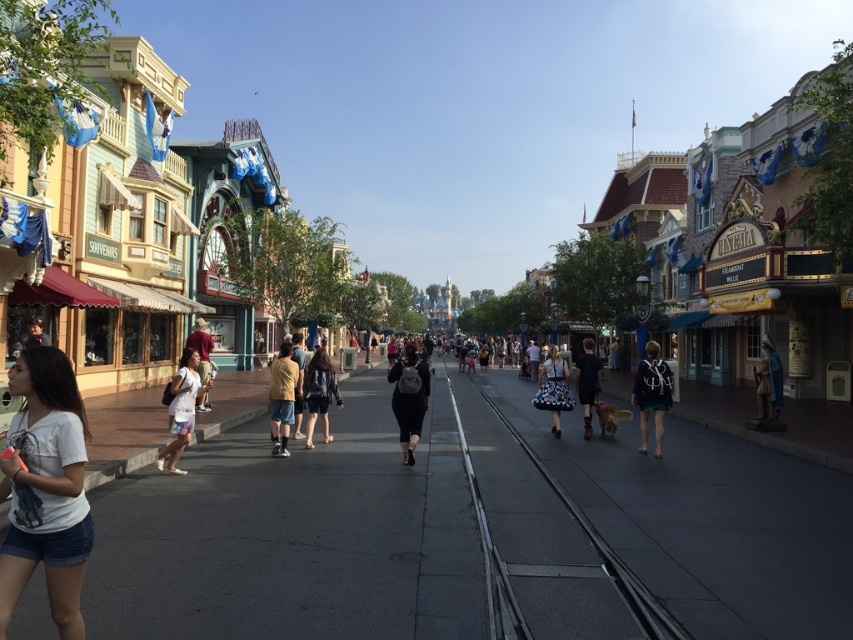
Can you confirm if black matte backpack at center is positioned to the right of dotted floral skirt at center?

Incorrect, black matte backpack at center is not on the right side of dotted floral skirt at center.

Does black matte backpack at center have a greater width compared to dotted floral skirt at center?

No.

Which is behind, point (402, 460) or point (544, 394)?

Positioned behind is point (544, 394).

The image size is (853, 640). I want to click on black matte backpack at center, so click(409, 397).

Between white cotton t-shirt at lower left and denim jacket at center, which one appears on the right side from the viewer's perspective?

denim jacket at center

Does white cotton t-shirt at lower left have a larger size compared to denim jacket at center?

Incorrect, white cotton t-shirt at lower left is not larger than denim jacket at center.

Find the location of a particular element. This screenshot has height=640, width=853. white cotton t-shirt at lower left is located at coordinates [x=45, y=490].

At what (x,y) coordinates should I click in order to perform the action: click on white cotton t-shirt at lower left. Please return your answer as a coordinate pair (x, y). Looking at the image, I should click on (45, 490).

Is point (4, 595) positioned after point (183, 470)?

No, (4, 595) is in front of (183, 470).

Which of these two, white cotton t-shirt at lower left or white cotton dress at lower left, stands taller?

With more height is white cotton t-shirt at lower left.

This screenshot has height=640, width=853. I want to click on white cotton t-shirt at lower left, so click(45, 490).

Where is `white cotton t-shirt at lower left`? Image resolution: width=853 pixels, height=640 pixels. white cotton t-shirt at lower left is located at coordinates coord(45,490).